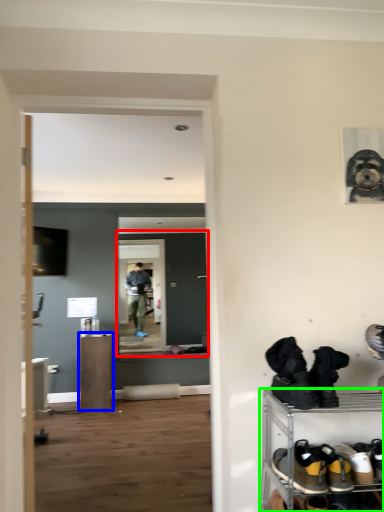
Question: Which object is positioned closest to glass door (highlighted by a red box)? Select from furniture (highlighted by a blue box) and shelf (highlighted by a green box).

Choices:
 (A) furniture
 (B) shelf

Answer: (A)